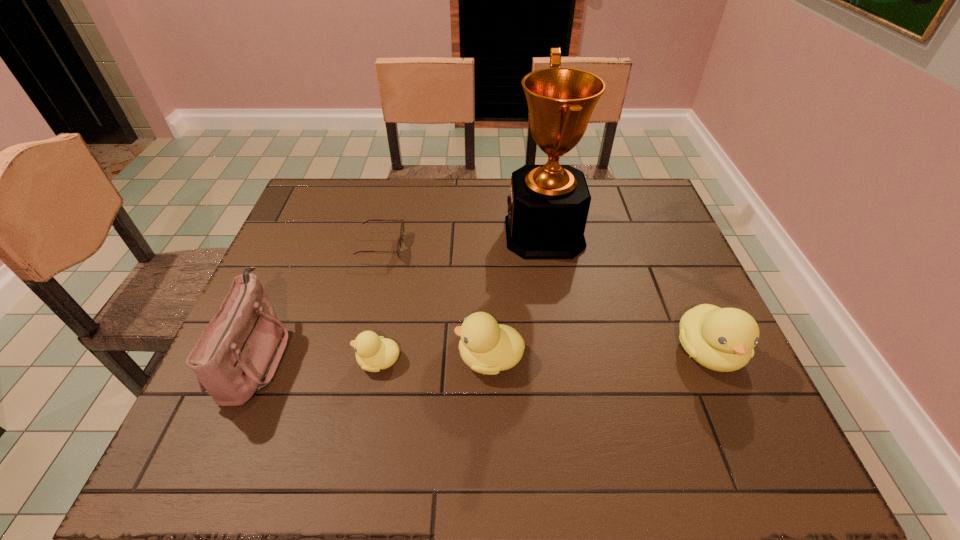
Identify the location of the shortest duckling. This screenshot has width=960, height=540. (374, 353).

Find the location of a particular element. the fifth tallest object is located at coordinates (374, 353).

At what (x,y) coordinates should I click in order to perform the action: click on the second duckling from left to right. Please return your answer as a coordinate pair (x, y). Looking at the image, I should click on (487, 347).

Identify the location of the second shortest duckling. (487, 347).

Find the location of a particular element. The width and height of the screenshot is (960, 540). the rightmost object is located at coordinates (722, 339).

Locate an element on the screen. This screenshot has width=960, height=540. the tallest object is located at coordinates (548, 206).

Where is `the shortest object`? Image resolution: width=960 pixels, height=540 pixels. the shortest object is located at coordinates (398, 250).

Identify the location of the leftmost object. This screenshot has height=540, width=960. (238, 353).

The width and height of the screenshot is (960, 540). I want to click on blank space located at the beak of the fifth tallest object, so click(x=288, y=361).

What are the coordinates of `free space located at the beak of the fifth tallest object` in the screenshot? It's located at (225, 361).